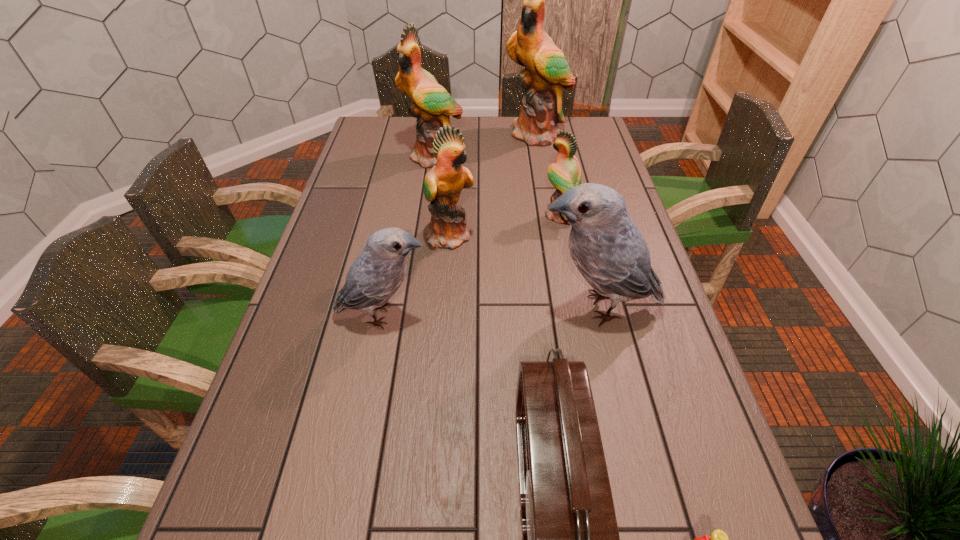
Find the location of `free space between the left gray parrot and the third biggest green parrot`. free space between the left gray parrot and the third biggest green parrot is located at coordinates (417, 275).

Where is `the seventh closest object to the red Lego`? Image resolution: width=960 pixels, height=540 pixels. the seventh closest object to the red Lego is located at coordinates (546, 71).

Where is `object that is the seventh closest to the second smallest green parrot`? object that is the seventh closest to the second smallest green parrot is located at coordinates (718, 539).

Locate which parrot is the third closest to the biggest green parrot. Please provide its 2D coordinates. Your answer should be formatted as a tuple, i.e. [(x, y)], where the tuple contains the x and y coordinates of a point satisfying the conditions above.

[(443, 184)]

Select which parrot appears as the third closest to the Lego. Please provide its 2D coordinates. Your answer should be formatted as a tuple, i.e. [(x, y)], where the tuple contains the x and y coordinates of a point satisfying the conditions above.

[(443, 184)]

Identify which green parrot is located as the nearest to the smallest green parrot. Please provide its 2D coordinates. Your answer should be formatted as a tuple, i.e. [(x, y)], where the tuple contains the x and y coordinates of a point satisfying the conditions above.

[(443, 184)]

Choose which green parrot is the third nearest neighbor to the seventh shortest object. Please provide its 2D coordinates. Your answer should be formatted as a tuple, i.e. [(x, y)], where the tuple contains the x and y coordinates of a point satisfying the conditions above.

[(565, 174)]

Locate an element on the screen. The height and width of the screenshot is (540, 960). vacant region that satisfies the following two spatial constraints: 1. on the front-facing side of the second tallest object; 2. on the front-facing side of the left gray parrot is located at coordinates (412, 315).

Image resolution: width=960 pixels, height=540 pixels. I want to click on vacant region that satisfies the following two spatial constraints: 1. on the front-facing side of the biggest green parrot; 2. on the front-facing side of the second smallest green parrot, so click(x=556, y=235).